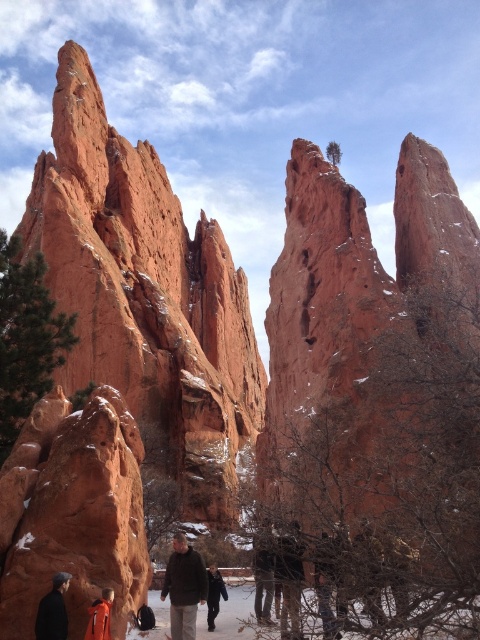
You are a photographer trying to capture the rustic sandstone rock formation at center and the dark brown leather jacket at center in the same frame. Based on their sizes, do you think both can fit in the same photo without cropping either of them?

The rustic sandstone rock formation at center might be wider than dark brown leather jacket at center, so it depends on the camera angle and zoom level whether both can fit without cropping.

You are a photographer planning to capture the rustic sandstone rock formation at center and the brown woolen jacket at center in a single shot. Considering their sizes, which object will appear bigger in the photo?

The rustic sandstone rock formation at center will appear bigger in the photo because it has a larger size compared to the brown woolen jacket at center.

You are a photographer planning to capture a photo of the dark brown leather jacket at center and the orange fabric jacket at lower left. Based on their positions, which jacket should you focus on first if you want to maintain both in the frame without moving the camera?

The dark brown leather jacket at center is located below the orange fabric jacket at lower left. To keep both in frame without moving the camera, focus on the orange fabric jacket at lower left first since it is higher up, ensuring the lower jacket remains in view.